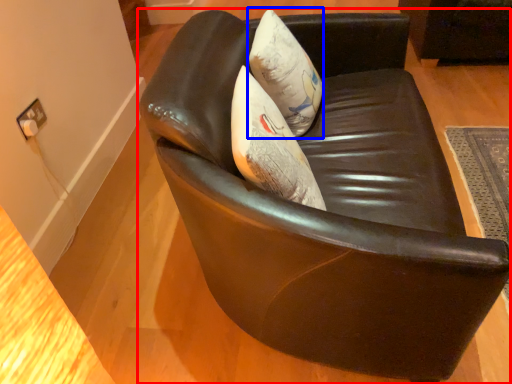
Question: Which of the following is the closest to the observer, chair (highlighted by a red box) or throw pillow (highlighted by a blue box)?

Choices:
 (A) chair
 (B) throw pillow

Answer: (A)